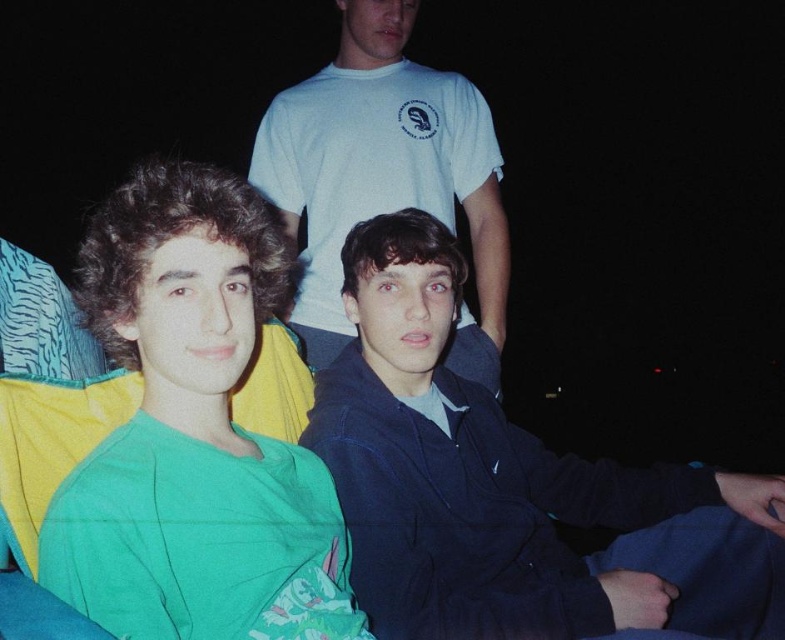
Looking at this image, is dark blue jacket at center in front of white t-shirt at upper center?

That is True.

Is point (349, 244) closer to camera compared to point (278, 172)?

Yes, it is.

Find the location of a particular element. This screenshot has height=640, width=785. dark blue jacket at center is located at coordinates (510, 486).

Which is behind, point (426, 326) or point (243, 596)?

Point (426, 326)

Does dark blue jacket at center come behind green matte shirt at center?

Yes.

Is point (301, 442) behind point (181, 481)?

Yes, point (301, 442) is farther from viewer.

Where is `dark blue jacket at center`? The width and height of the screenshot is (785, 640). dark blue jacket at center is located at coordinates (510, 486).

Is green matte shirt at center below white t-shirt at upper center?

Yes, green matte shirt at center is below white t-shirt at upper center.

Does green matte shirt at center appear on the left side of white t-shirt at upper center?

Correct, you'll find green matte shirt at center to the left of white t-shirt at upper center.

At what (x,y) coordinates should I click in order to perform the action: click on green matte shirt at center. Please return your answer as a coordinate pair (x, y). The width and height of the screenshot is (785, 640). Looking at the image, I should click on (192, 435).